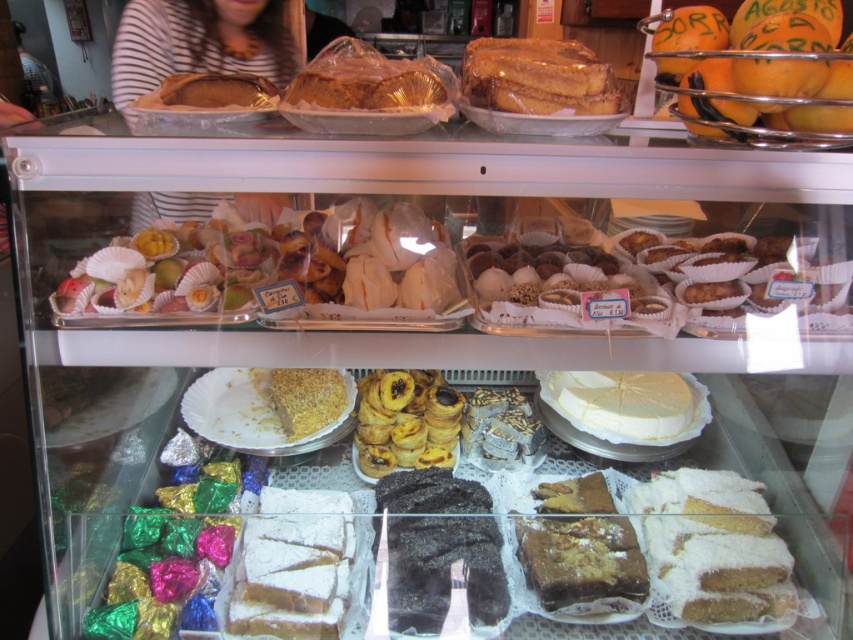
You are a customer in the bakery and want to find the shiny gold shells at center. Where exactly are they located in the display case?

The shiny gold shells at center are located at the 2D coordinates point (270, 269) in the display case.

You are a customer at the bakery and want to buy both the shiny gold shells at center and the powdered sugar cake at lower right. Which item is placed higher in the display case?

The shiny gold shells at center is located above the powdered sugar cake at lower right, so it is placed higher in the display case.

You are a customer at the bakery and want to choose a cake that is thicker. Which one should you pick between the black matte cake at center and the golden crumbly cake at center?

The golden crumbly cake at center is thicker than the black matte cake at center, so you should pick the golden crumbly cake at center.